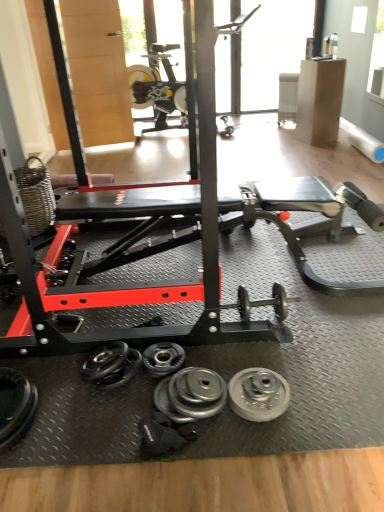
What do you see at coordinates (197, 392) in the screenshot?
I see `silver metallic dumbbell at center, acting as the third dumbbell starting from the left` at bounding box center [197, 392].

This screenshot has height=512, width=384. I want to click on silver metallic dumbbell at lower left, arranged as the first dumbbell when viewed from the left, so click(x=15, y=406).

What do you see at coordinates (15, 406) in the screenshot? I see `silver metallic dumbbell at lower left, the 3th dumbbell positioned from the right` at bounding box center [15, 406].

Where is `silver metallic dumbbell at center, the second dumbbell when ordered from left to right`? The image size is (384, 512). silver metallic dumbbell at center, the second dumbbell when ordered from left to right is located at coordinates (163, 359).

What do you see at coordinates (163, 359) in the screenshot? This screenshot has height=512, width=384. I see `silver metallic dumbbell at center, the second dumbbell when ordered from left to right` at bounding box center [163, 359].

Locate an element on the screen. This screenshot has width=384, height=512. silver metallic weight at center, arranged as the second wheel when viewed from the left is located at coordinates (258, 394).

This screenshot has height=512, width=384. Describe the element at coordinates (258, 394) in the screenshot. I see `silver metallic weight at center, arranged as the second wheel when viewed from the left` at that location.

Find the location of `silver metallic dumbbell at center, acting as the third dumbbell starting from the left`. silver metallic dumbbell at center, acting as the third dumbbell starting from the left is located at coordinates (197, 392).

Considering the positions of points (144, 366) and (182, 57), is point (144, 366) farther from camera compared to point (182, 57)?

No, (144, 366) is closer to viewer.

Does silver metallic dumbbell at center, marked as the 2th dumbbell in a right-to-left arrangement, have a smaller size compared to transparent glass window at upper center?

Indeed, silver metallic dumbbell at center, marked as the 2th dumbbell in a right-to-left arrangement, has a smaller size compared to transparent glass window at upper center.

Is transparent glass window at upper center located within silver metallic dumbbell at center, the second dumbbell when ordered from left to right?

No, silver metallic dumbbell at center, the second dumbbell when ordered from left to right, does not contain transparent glass window at upper center.

The height and width of the screenshot is (512, 384). Identify the location of wheel beneath the silver metallic dumbbell at center, acting as the third dumbbell starting from the left (from a real-world perspective). (168, 402).

Is silver metallic weight at center, which is the first wheel in left-to-right order, aimed at silver metallic dumbbell at center, which is the first dumbbell from right to left?

No, silver metallic weight at center, which is the first wheel in left-to-right order, is not turned towards silver metallic dumbbell at center, which is the first dumbbell from right to left.

Looking at this image, between silver metallic weight at center, marked as the second wheel in a right-to-left arrangement, and silver metallic dumbbell at center, which is the first dumbbell from right to left, which one has smaller width?

silver metallic weight at center, marked as the second wheel in a right-to-left arrangement, is thinner.

Is silver metallic dumbbell at center, marked as the 2th dumbbell in a right-to-left arrangement, not within silver metallic weight at center, arranged as the second wheel when viewed from the left?

silver metallic dumbbell at center, marked as the 2th dumbbell in a right-to-left arrangement, lies outside silver metallic weight at center, arranged as the second wheel when viewed from the left,'s area.

Does silver metallic dumbbell at center, marked as the 2th dumbbell in a right-to-left arrangement, have a greater height compared to silver metallic weight at center, arranged as the second wheel when viewed from the left?

Correct, silver metallic dumbbell at center, marked as the 2th dumbbell in a right-to-left arrangement, is much taller as silver metallic weight at center, arranged as the second wheel when viewed from the left.

From a real-world perspective, starting from the silver metallic weight at center, the 1th wheel in the right-to-left sequence, which dumbbell is the 2nd one below it? Please provide its 2D coordinates.

[(163, 359)]

Considering the positions of points (143, 360) and (234, 381), is point (143, 360) farther from camera compared to point (234, 381)?

Yes, point (143, 360) is farther from viewer.

Is point (186, 418) farther from camera compared to point (15, 386)?

No, it is in front of (15, 386).

Could you tell me if silver metallic weight at center, marked as the second wheel in a right-to-left arrangement, is turned towards silver metallic dumbbell at lower left, arranged as the first dumbbell when viewed from the left?

No, silver metallic weight at center, marked as the second wheel in a right-to-left arrangement, is not turned towards silver metallic dumbbell at lower left, arranged as the first dumbbell when viewed from the left.

Relative to silver metallic dumbbell at lower left, arranged as the first dumbbell when viewed from the left, is silver metallic weight at center, which is the first wheel in left-to-right order, in front or behind?

silver metallic weight at center, which is the first wheel in left-to-right order, is behind silver metallic dumbbell at lower left, arranged as the first dumbbell when viewed from the left.

Does silver metallic weight at center, marked as the second wheel in a right-to-left arrangement, have a larger size compared to silver metallic dumbbell at lower left, the 3th dumbbell positioned from the right?

Actually, silver metallic weight at center, marked as the second wheel in a right-to-left arrangement, might be smaller than silver metallic dumbbell at lower left, the 3th dumbbell positioned from the right.

From a real-world perspective, is silver metallic dumbbell at lower left, the 3th dumbbell positioned from the right, positioned over silver metallic dumbbell at center, marked as the 2th dumbbell in a right-to-left arrangement, based on gravity?

Yes, from a real-world perspective, silver metallic dumbbell at lower left, the 3th dumbbell positioned from the right, is over silver metallic dumbbell at center, marked as the 2th dumbbell in a right-to-left arrangement

Can you confirm if silver metallic dumbbell at lower left, the 3th dumbbell positioned from the right, is positioned to the left of silver metallic dumbbell at center, the second dumbbell when ordered from left to right?

Yes.

Can you confirm if silver metallic dumbbell at lower left, the 3th dumbbell positioned from the right, is shorter than silver metallic dumbbell at center, the second dumbbell when ordered from left to right?

No, silver metallic dumbbell at lower left, the 3th dumbbell positioned from the right, is not shorter than silver metallic dumbbell at center, the second dumbbell when ordered from left to right.

Are silver metallic dumbbell at lower left, the 3th dumbbell positioned from the right, and silver metallic dumbbell at center, the second dumbbell when ordered from left to right, beside each other?

silver metallic dumbbell at lower left, the 3th dumbbell positioned from the right, and silver metallic dumbbell at center, the second dumbbell when ordered from left to right, are clearly separated.

Could you tell me if silver metallic dumbbell at center, which is the first dumbbell from right to left, is facing silver metallic dumbbell at center, the second dumbbell when ordered from left to right?

No, silver metallic dumbbell at center, which is the first dumbbell from right to left, is not aimed at silver metallic dumbbell at center, the second dumbbell when ordered from left to right.

Can you confirm if silver metallic dumbbell at center, acting as the third dumbbell starting from the left, is smaller than silver metallic dumbbell at center, marked as the 2th dumbbell in a right-to-left arrangement?

Incorrect, silver metallic dumbbell at center, acting as the third dumbbell starting from the left, is not smaller in size than silver metallic dumbbell at center, marked as the 2th dumbbell in a right-to-left arrangement.

Is point (214, 394) positioned behind point (165, 372)?

No, it is in front of (165, 372).

Where is `dumbbell that appears below the silver metallic dumbbell at center, which is the first dumbbell from right to left (from a real-world perspective)`? Image resolution: width=384 pixels, height=512 pixels. dumbbell that appears below the silver metallic dumbbell at center, which is the first dumbbell from right to left (from a real-world perspective) is located at coordinates (163, 359).

Which of these two, transparent glass window at upper center or silver metallic dumbbell at center, acting as the third dumbbell starting from the left, stands taller?

With more height is transparent glass window at upper center.

Between transparent glass window at upper center and silver metallic dumbbell at center, which is the first dumbbell from right to left, which one is positioned behind?

transparent glass window at upper center is further away from the camera.

Between point (278, 89) and point (179, 410), which one is positioned in front?

Positioned in front is point (179, 410).

What's the angular difference between transparent glass window at upper center and silver metallic dumbbell at center, which is the first dumbbell from right to left,'s facing directions?

They differ by 5.25 degrees in their facing directions.

I want to click on window screen lying behind the silver metallic dumbbell at center, marked as the 2th dumbbell in a right-to-left arrangement, so click(272, 48).

Locate an element on the screen. This screenshot has width=384, height=512. the 2nd dumbbell directly above the silver metallic weight at center, which is the first wheel in left-to-right order (from a real-world perspective) is located at coordinates (197, 392).

When comparing their distances from transparent glass window at upper center, does silver metallic dumbbell at center, marked as the 2th dumbbell in a right-to-left arrangement, or silver metallic dumbbell at lower left, arranged as the first dumbbell when viewed from the left, seem closer?

silver metallic dumbbell at center, marked as the 2th dumbbell in a right-to-left arrangement, is positioned closer to the anchor transparent glass window at upper center.

When comparing their distances from silver metallic weight at center, marked as the second wheel in a right-to-left arrangement, does silver metallic weight at center, the 1th wheel in the right-to-left sequence, or silver metallic dumbbell at center, marked as the 2th dumbbell in a right-to-left arrangement, seem further?

silver metallic weight at center, the 1th wheel in the right-to-left sequence, lies further to silver metallic weight at center, marked as the second wheel in a right-to-left arrangement, than the other object.

From the image, which object appears to be nearer to silver metallic weight at center, which is the first wheel in left-to-right order, silver metallic dumbbell at center, acting as the third dumbbell starting from the left, or transparent glass window at upper center?

silver metallic dumbbell at center, acting as the third dumbbell starting from the left, lies closer to silver metallic weight at center, which is the first wheel in left-to-right order, than the other object.

Which object lies nearer to the anchor point silver metallic dumbbell at lower left, the 3th dumbbell positioned from the right, silver metallic dumbbell at center, acting as the third dumbbell starting from the left, or silver metallic dumbbell at center, the second dumbbell when ordered from left to right?

Based on the image, silver metallic dumbbell at center, the second dumbbell when ordered from left to right, appears to be nearer to silver metallic dumbbell at lower left, the 3th dumbbell positioned from the right.

Which object lies nearer to the anchor point silver metallic dumbbell at lower left, arranged as the first dumbbell when viewed from the left, transparent glass window at upper center or silver metallic weight at center, marked as the second wheel in a right-to-left arrangement?

silver metallic weight at center, marked as the second wheel in a right-to-left arrangement.

Looking at the image, which one is located closer to silver metallic dumbbell at lower left, arranged as the first dumbbell when viewed from the left, silver metallic weight at center, arranged as the second wheel when viewed from the left, or silver metallic dumbbell at center, marked as the 2th dumbbell in a right-to-left arrangement?

Based on the image, silver metallic dumbbell at center, marked as the 2th dumbbell in a right-to-left arrangement, appears to be nearer to silver metallic dumbbell at lower left, arranged as the first dumbbell when viewed from the left.

From the image, which object appears to be farther from transparent glass window at upper center, silver metallic weight at center, marked as the second wheel in a right-to-left arrangement, or silver metallic weight at center, the 1th wheel in the right-to-left sequence?

silver metallic weight at center, marked as the second wheel in a right-to-left arrangement, is further to transparent glass window at upper center.

Considering their positions, is silver metallic dumbbell at lower left, arranged as the first dumbbell when viewed from the left, positioned further to silver metallic weight at center, which is the first wheel in left-to-right order, than silver metallic weight at center, the 1th wheel in the right-to-left sequence?

The object further to silver metallic weight at center, which is the first wheel in left-to-right order, is silver metallic dumbbell at lower left, arranged as the first dumbbell when viewed from the left.

The width and height of the screenshot is (384, 512). I want to click on wheel between silver metallic dumbbell at lower left, the 3th dumbbell positioned from the right, and silver metallic weight at center, the 1th wheel in the right-to-left sequence, in the horizontal direction, so click(168, 402).

The image size is (384, 512). I want to click on wheel located between silver metallic dumbbell at lower left, the 3th dumbbell positioned from the right, and silver metallic dumbbell at center, which is the first dumbbell from right to left, in the left-right direction, so click(x=168, y=402).

This screenshot has width=384, height=512. I want to click on dumbbell located between silver metallic dumbbell at lower left, the 3th dumbbell positioned from the right, and silver metallic dumbbell at center, acting as the third dumbbell starting from the left, in the left-right direction, so click(163, 359).

Find the location of a particular element. Image resolution: width=384 pixels, height=512 pixels. wheel located between silver metallic dumbbell at center, marked as the 2th dumbbell in a right-to-left arrangement, and silver metallic weight at center, arranged as the second wheel when viewed from the left, in the left-right direction is located at coordinates (168, 402).